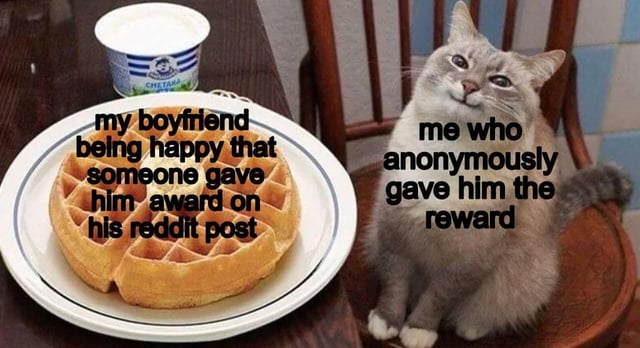
Find the location of a particular element. Image resolution: width=640 pixels, height=348 pixels. chair seat is located at coordinates (595, 259).